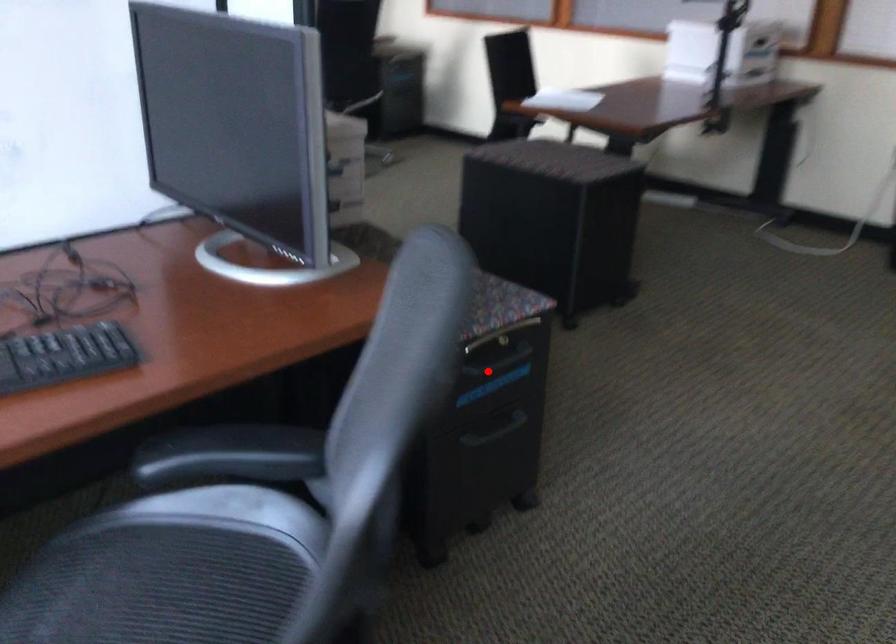
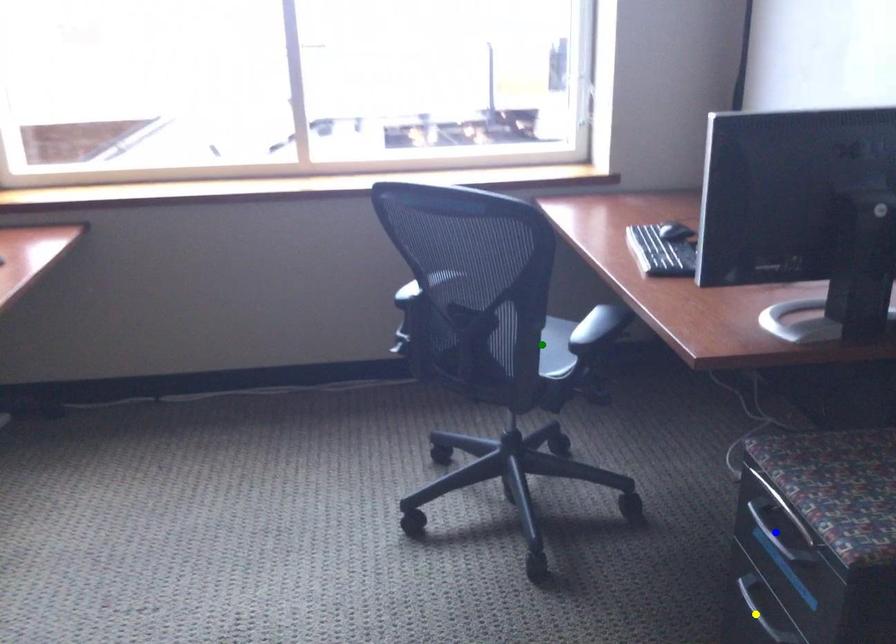
Question: I am providing you with two images of the same scene from different viewpoints. A red point is marked on the first image. You are given multiple points on the second image. Which point in image 2 is actually the same real-world point as the red point in image 1?

Choices:
 (A) blue point
 (B) yellow point
 (C) green point

Answer: (A)